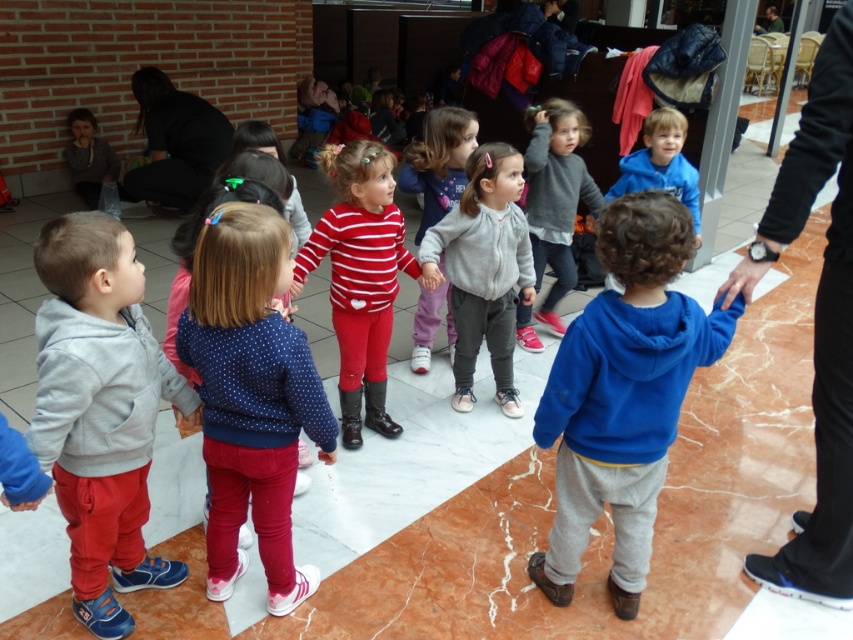
Does blue dotted sweater at center have a smaller size compared to gray fleece sweater at center?

Yes.

Who is shorter, blue dotted sweater at center or gray fleece sweater at center?

With less height is blue dotted sweater at center.

Where is `blue dotted sweater at center`? The width and height of the screenshot is (853, 640). blue dotted sweater at center is located at coordinates (251, 396).

Locate an element on the screen. The height and width of the screenshot is (640, 853). blue dotted sweater at center is located at coordinates (251, 396).

Is blue fleece sweatshirt at center bigger than striped fabric dress at center?

Yes.

Between point (660, 208) and point (438, 122), which one is positioned in front?

Point (660, 208)

This screenshot has width=853, height=640. What are the coordinates of `blue fleece sweatshirt at center` in the screenshot? It's located at (622, 394).

Who is positioned more to the right, matte gray hoodie at left or striped fabric dress at center?

striped fabric dress at center

Does point (131, 308) lie in front of point (440, 257)?

Yes, point (131, 308) is in front of point (440, 257).

This screenshot has width=853, height=640. In order to click on matte gray hoodie at left in this screenshot , I will do `click(100, 410)`.